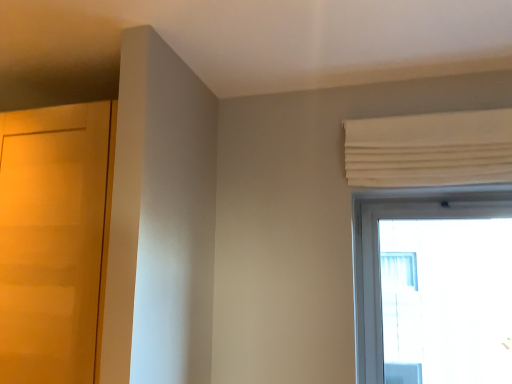
What do you see at coordinates (430, 149) in the screenshot? Image resolution: width=512 pixels, height=384 pixels. I see `white pleated curtain at upper right` at bounding box center [430, 149].

Image resolution: width=512 pixels, height=384 pixels. I want to click on white pleated curtain at upper right, so click(x=430, y=149).

In order to face matte wood door at left, should I rotate leftwards or rightwards?

Turn left approximately 21.755 degrees to face it.

Identify the location of matte wood door at left. (51, 241).

Measure the distance between matte wood door at left and camera.

matte wood door at left and camera are 4.66 feet apart.

The image size is (512, 384). What do you see at coordinates (51, 241) in the screenshot? I see `matte wood door at left` at bounding box center [51, 241].

At what (x,y) coordinates should I click in order to perform the action: click on white pleated curtain at upper right. Please return your answer as a coordinate pair (x, y). Looking at the image, I should click on (430, 149).

Considering the relative positions of matte wood door at left and white pleated curtain at upper right in the image provided, is matte wood door at left to the left or to the right of white pleated curtain at upper right?

Based on their positions, matte wood door at left is located to the left of white pleated curtain at upper right.

Which object is closer to the camera, matte wood door at left or white pleated curtain at upper right?

matte wood door at left.

Does point (71, 248) come in front of point (366, 158)?

Yes, it is.

From the image's perspective, is matte wood door at left on top of white pleated curtain at upper right?

No, from the image's perspective, matte wood door at left is not on top of white pleated curtain at upper right.

From a real-world perspective, which object rests below the other?

matte wood door at left is physically lower.

Is matte wood door at left wider or thinner than white pleated curtain at upper right?

matte wood door at left is wider than white pleated curtain at upper right.

From the picture: From their relative heights in the image, would you say matte wood door at left is taller or shorter than white pleated curtain at upper right?

Clearly, matte wood door at left is taller compared to white pleated curtain at upper right.

Considering the relative sizes of matte wood door at left and white pleated curtain at upper right in the image provided, is matte wood door at left smaller than white pleated curtain at upper right?

Incorrect, matte wood door at left is not smaller in size than white pleated curtain at upper right.

Is matte wood door at left located outside white pleated curtain at upper right?

matte wood door at left lies outside white pleated curtain at upper right's area.

Is matte wood door at left touching white pleated curtain at upper right?

No, matte wood door at left is not making contact with white pleated curtain at upper right.

Is matte wood door at left turned away from white pleated curtain at upper right?

No.

How many degrees apart are the facing directions of matte wood door at left and white pleated curtain at upper right?

matte wood door at left and white pleated curtain at upper right are facing 0.29 degrees away from each other.

Where is `door that appears in front of the white pleated curtain at upper right`? This screenshot has height=384, width=512. door that appears in front of the white pleated curtain at upper right is located at coordinates (51, 241).

Between white pleated curtain at upper right and matte wood door at left, which one appears on the right side from the viewer's perspective?

white pleated curtain at upper right is more to the right.

Which is in front, white pleated curtain at upper right or matte wood door at left?

matte wood door at left is more forward.

Considering the points (406, 132) and (94, 121), which point is in front, point (406, 132) or point (94, 121)?

Positioned in front is point (94, 121).

From the image's perspective, would you say white pleated curtain at upper right is positioned over matte wood door at left?

Indeed, from the image's perspective, white pleated curtain at upper right is shown above matte wood door at left.

From a real-world perspective, who is located higher, white pleated curtain at upper right or matte wood door at left?

white pleated curtain at upper right.

Which object is thinner, white pleated curtain at upper right or matte wood door at left?

With smaller width is white pleated curtain at upper right.

In terms of height, does white pleated curtain at upper right look taller or shorter compared to matte wood door at left?

Clearly, white pleated curtain at upper right is shorter compared to matte wood door at left.

Between white pleated curtain at upper right and matte wood door at left, which one has smaller size?

Smaller between the two is white pleated curtain at upper right.

In the scene shown: Would you say matte wood door at left is part of white pleated curtain at upper right's contents?

No, matte wood door at left is not inside white pleated curtain at upper right.

Is white pleated curtain at upper right directly adjacent to matte wood door at left?

No, white pleated curtain at upper right is not touching matte wood door at left.

Is white pleated curtain at upper right turned away from matte wood door at left?

No, white pleated curtain at upper right is not facing away from matte wood door at left.

How many degrees apart are the facing directions of white pleated curtain at upper right and matte wood door at left?

0.29 degrees separate the facing orientations of white pleated curtain at upper right and matte wood door at left.

This screenshot has height=384, width=512. Identify the location of curtain that appears on the right of matte wood door at left. (430, 149).

Locate an element on the screen. Image resolution: width=512 pixels, height=384 pixels. door lying below the white pleated curtain at upper right (from the image's perspective) is located at coordinates (51, 241).

Where is `curtain on the right of the matte wood door at left`? The height and width of the screenshot is (384, 512). curtain on the right of the matte wood door at left is located at coordinates (430, 149).